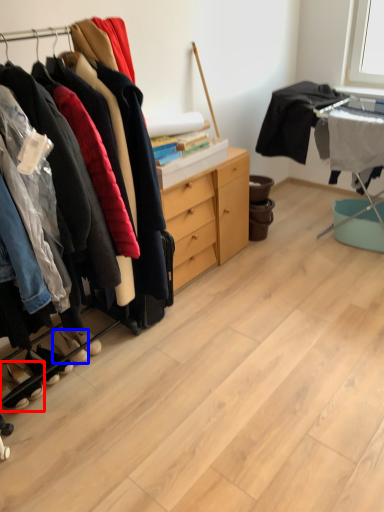
Question: Which of the following is the farthest to the observer, footwear (highlighted by a red box) or footwear (highlighted by a blue box)?

Choices:
 (A) footwear
 (B) footwear

Answer: (B)